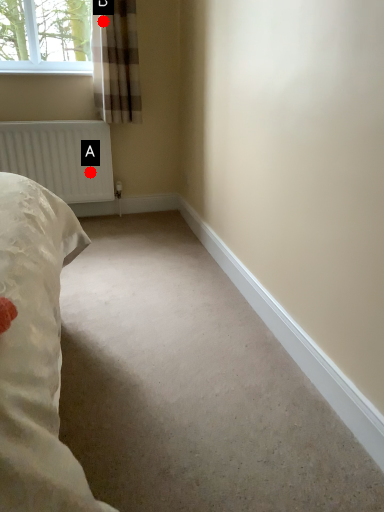
Question: Two points are circled on the image, labeled by A and B beside each circle. Which point is further to the camera?

Choices:
 (A) A is further
 (B) B is further

Answer: (A)